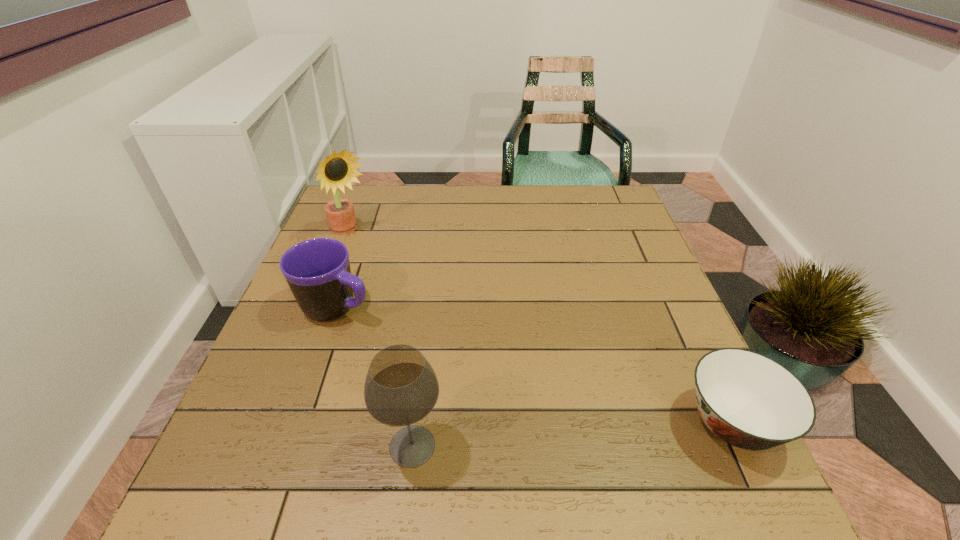
At what (x,y) coordinates should I click in order to perform the action: click on vacant region between the second object from right to left and the farthest object. Please return your answer as a coordinate pair (x, y). The width and height of the screenshot is (960, 540). Looking at the image, I should click on (382, 340).

Locate an element on the screen. The height and width of the screenshot is (540, 960). free space between the second object from right to left and the shortest object is located at coordinates (572, 435).

The width and height of the screenshot is (960, 540). In order to click on vacant area between the third nearest object and the shortest object in this screenshot , I will do `click(535, 365)`.

Identify the location of vacant area that lies between the farthest object and the wineglass. pyautogui.click(x=382, y=340).

Find the location of a particular element. This screenshot has height=540, width=960. free space between the wineglass and the sunflower is located at coordinates (382, 340).

You are a GUI agent. You are given a task and a screenshot of the screen. Output one action in this format:
    pyautogui.click(x=<x>, y=<y>)
    Task: Click on the vacant area between the mug and the rightmost object
    
    Given the screenshot: What is the action you would take?
    point(535,365)

Where is `object that stands as the second closest to the sunflower`? This screenshot has width=960, height=540. object that stands as the second closest to the sunflower is located at coordinates (401, 388).

Identify which object is the third nearest to the third nearest object. Please provide its 2D coordinates. Your answer should be formatted as a tuple, i.e. [(x, y)], where the tuple contains the x and y coordinates of a point satisfying the conditions above.

[(748, 400)]

I want to click on free region that satisfies the following two spatial constraints: 1. on the front side of the second tallest object; 2. on the left side of the second farthest object, so click(291, 446).